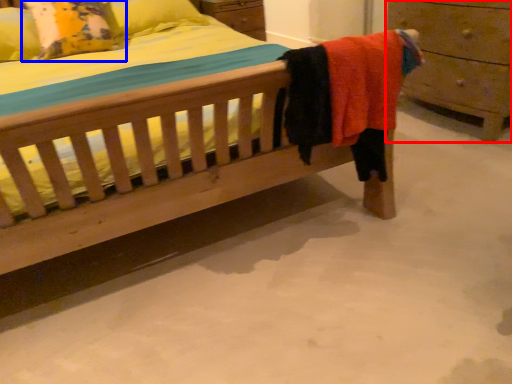
Question: Among these objects, which one is farthest to the camera, chest of drawers (highlighted by a red box) or pillow (highlighted by a blue box)?

Choices:
 (A) chest of drawers
 (B) pillow

Answer: (B)